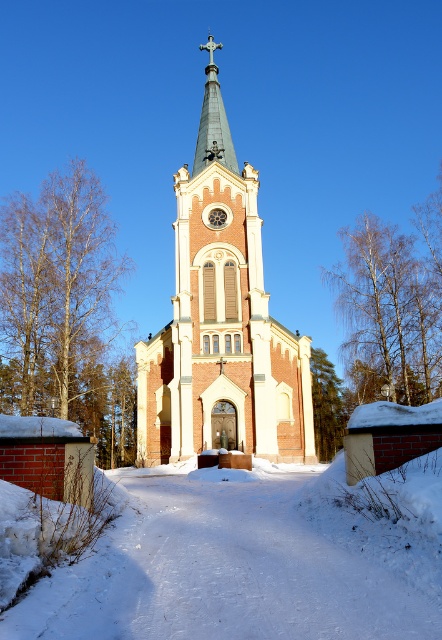
As an architect analyzing the church structure, you need to determine the spatial relationship between the light beige stone church steeple at center and the shiny gold spire at center. Which one has a greater width?

The light beige stone church steeple at center might be wider than shiny gold spire at center according to the description provided.

You are standing in front of the church and want to locate the shiny gold spire at center. According to the scene description, where should you look relative to the light beige stone church steeple at center?

The shiny gold spire at center is to the left of the light beige stone church steeple at center.

You are standing in front of the church and want to know which object is taller between the white powdery snow at center and the shiny gold spire at center. Can you tell me which one is taller?

The shiny gold spire at center is taller than the white powdery snow at center.